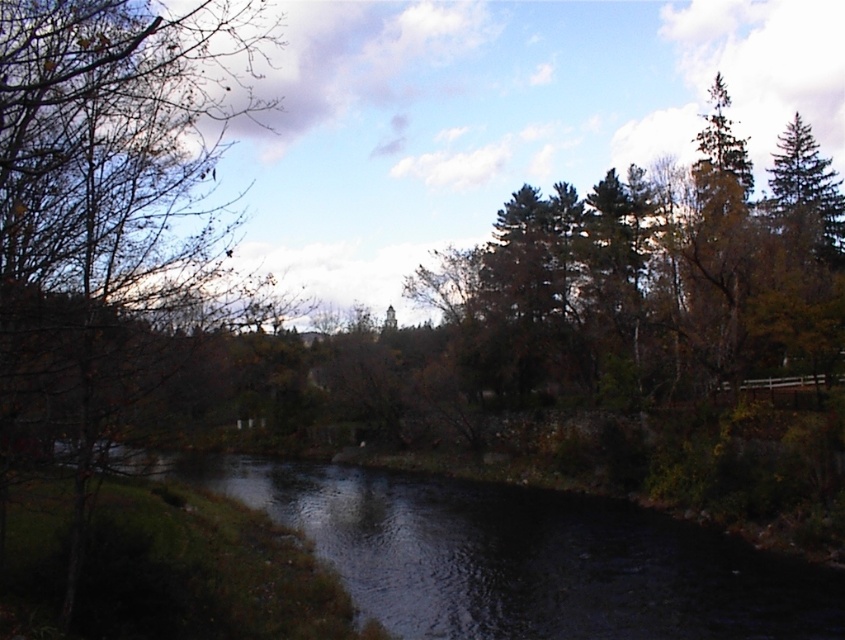
Question: Is brown leafy tree at left in front of dark reflective water at center?

Choices:
 (A) yes
 (B) no

Answer: (A)

Question: Can you confirm if brown leafy tree at left is thinner than dark reflective water at center?

Choices:
 (A) yes
 (B) no

Answer: (A)

Question: Is brown leafy tree at left behind dark reflective water at center?

Choices:
 (A) no
 (B) yes

Answer: (A)

Question: Which point is farther to the camera?

Choices:
 (A) click(442, 628)
 (B) click(36, 330)

Answer: (A)

Question: Among these objects, which one is farthest from the camera?

Choices:
 (A) brown leafy tree at left
 (B) dark reflective water at center

Answer: (B)

Question: Which point is farther to the camera?

Choices:
 (A) brown leafy tree at left
 (B) dark reflective water at center

Answer: (B)